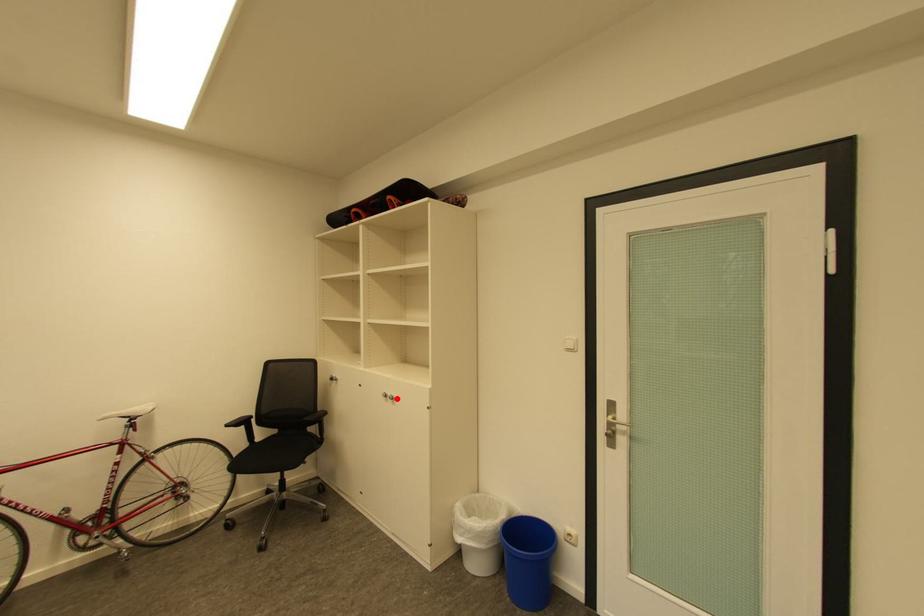
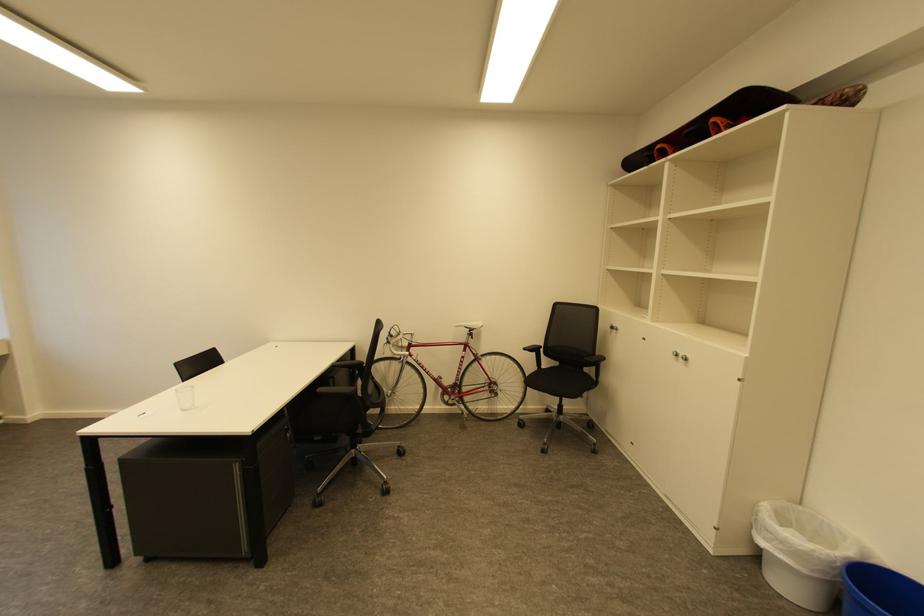
In the second image, find the point that corresponds to the highlighted location in the first image.

(689, 359)